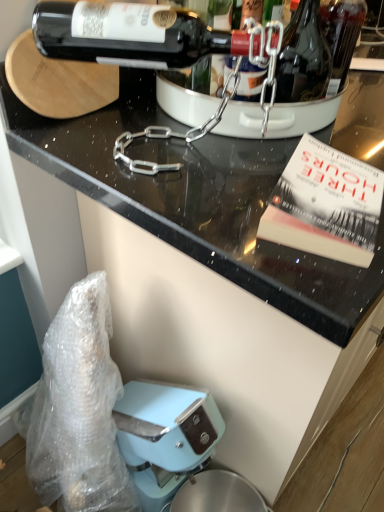
Question: From a real-world perspective, does shiny dark glass bottle at upper right stand above hardcover book at upper right?

Choices:
 (A) yes
 (B) no

Answer: (A)

Question: Considering the relative positions of shiny dark glass bottle at upper right and hardcover book at upper right in the image provided, is shiny dark glass bottle at upper right behind hardcover book at upper right?

Choices:
 (A) yes
 (B) no

Answer: (A)

Question: Is shiny dark glass bottle at upper right next to hardcover book at upper right and touching it?

Choices:
 (A) yes
 (B) no

Answer: (B)

Question: Is shiny dark glass bottle at upper right shorter than hardcover book at upper right?

Choices:
 (A) no
 (B) yes

Answer: (A)

Question: Is shiny dark glass bottle at upper right to the left of hardcover book at upper right from the viewer's perspective?

Choices:
 (A) yes
 (B) no

Answer: (B)

Question: Considering the relative positions of shiny dark glass bottle at upper right and hardcover book at upper right in the image provided, is shiny dark glass bottle at upper right in front of hardcover book at upper right?

Choices:
 (A) yes
 (B) no

Answer: (B)

Question: From a real-world perspective, is shiny dark glass bottle at upper center positioned over black glossy countertop at upper center based on gravity?

Choices:
 (A) no
 (B) yes

Answer: (B)

Question: Is shiny dark glass bottle at upper center positioned in front of black glossy countertop at upper center?

Choices:
 (A) no
 (B) yes

Answer: (A)

Question: Are shiny dark glass bottle at upper center and black glossy countertop at upper center beside each other?

Choices:
 (A) no
 (B) yes

Answer: (A)

Question: Does shiny dark glass bottle at upper center have a greater height compared to black glossy countertop at upper center?

Choices:
 (A) yes
 (B) no

Answer: (B)

Question: Is shiny dark glass bottle at upper center not close to black glossy countertop at upper center?

Choices:
 (A) yes
 (B) no

Answer: (B)

Question: Could black glossy countertop at upper center be considered to be inside shiny dark glass bottle at upper center?

Choices:
 (A) yes
 (B) no

Answer: (B)

Question: Are hardcover book at upper right and shiny dark glass bottle at upper right beside each other?

Choices:
 (A) yes
 (B) no

Answer: (B)